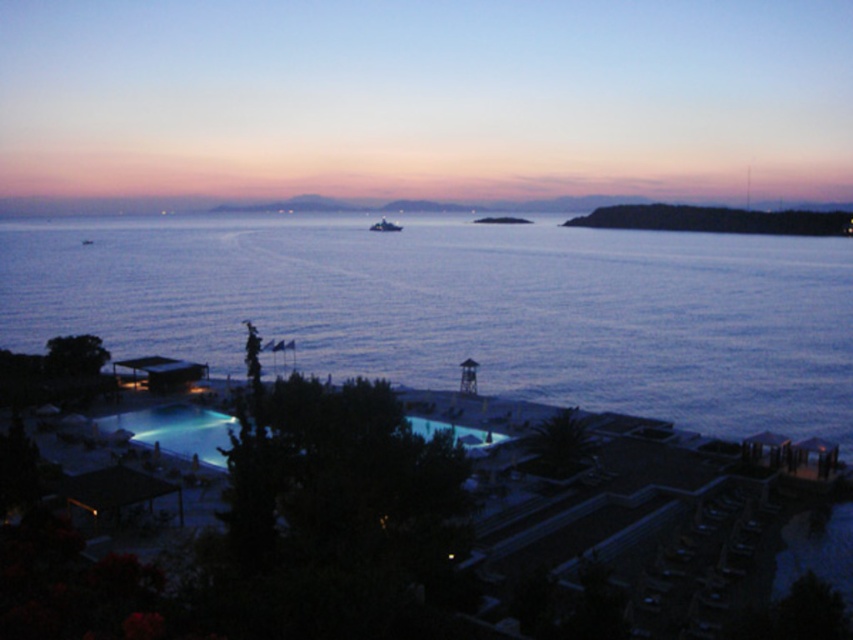
Looking at this image, does illuminated glass pool at center have a greater width compared to matte black building at lower left?

Yes, illuminated glass pool at center is wider than matte black building at lower left.

Is point (212, 433) positioned behind point (195, 372)?

No, it is not.

Is point (212, 442) in front of point (190, 381)?

Yes.

This screenshot has height=640, width=853. What are the coordinates of `illuminated glass pool at center` in the screenshot? It's located at (177, 429).

Is matte black building at lower left smaller than metallic blue boat at center?

Indeed, matte black building at lower left has a smaller size compared to metallic blue boat at center.

Identify the location of matte black building at lower left. (161, 371).

Is point (154, 378) farther from camera compared to point (398, 228)?

No, (154, 378) is closer to viewer.

The width and height of the screenshot is (853, 640). I want to click on matte black building at lower left, so tap(161, 371).

Who is shorter, blue water at center or illuminated glass pool at center?

illuminated glass pool at center

Does blue water at center come in front of illuminated glass pool at center?

No, it is behind illuminated glass pool at center.

The width and height of the screenshot is (853, 640). Describe the element at coordinates (466, 308) in the screenshot. I see `blue water at center` at that location.

Where is `blue water at center`? The image size is (853, 640). blue water at center is located at coordinates (466, 308).